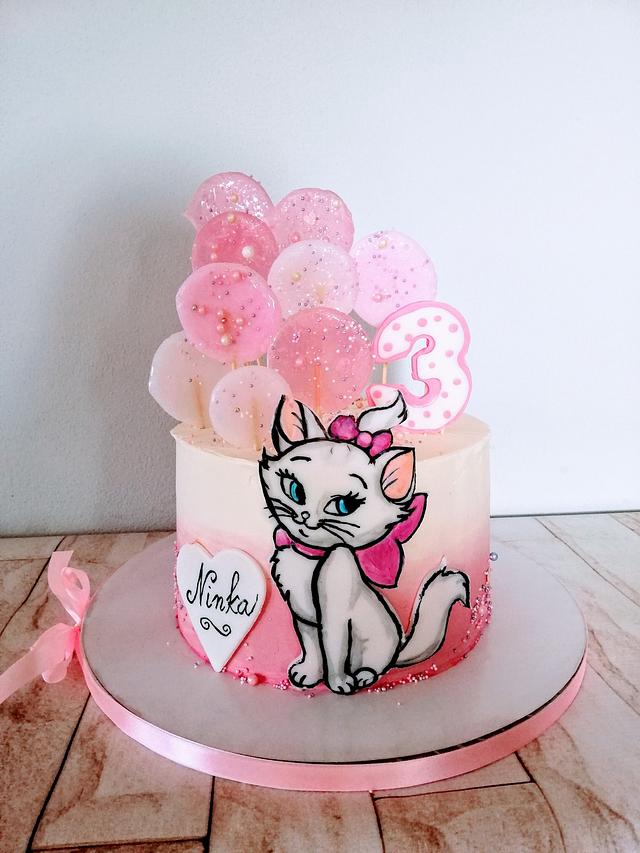
Where is `cake stand`? cake stand is located at coordinates (320, 734).